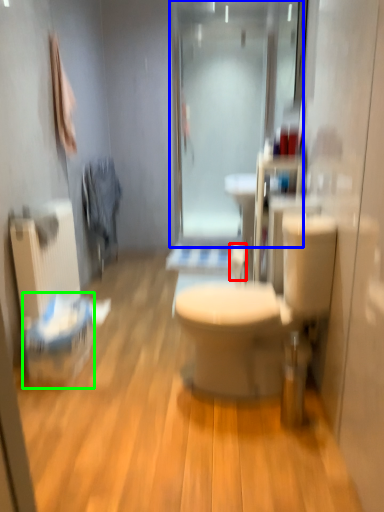
Question: Estimate the real-world distances between objects in this image. Which object is farther from toilet paper (highlighted by a red box), shower door (highlighted by a blue box) or laundry basket (highlighted by a green box)?

Choices:
 (A) shower door
 (B) laundry basket

Answer: (A)